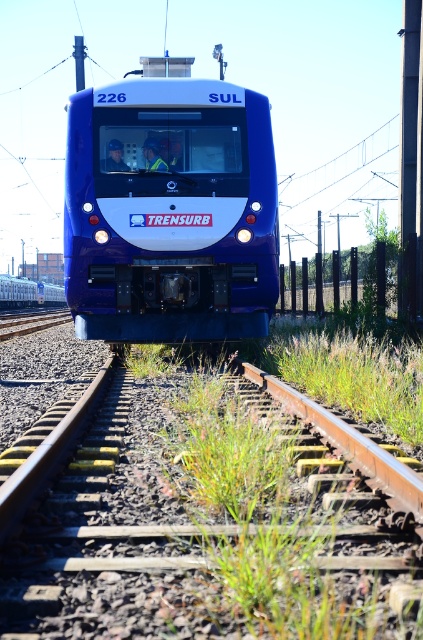
Question: Where is rusty metal train track at center located in relation to matte blue train at center in the image?

Choices:
 (A) left
 (B) right

Answer: (B)

Question: Among these objects, which one is nearest to the camera?

Choices:
 (A) matte blue train at center
 (B) rusty metal train track at center

Answer: (B)

Question: Is rusty metal train track at center positioned behind matte blue train at center?

Choices:
 (A) no
 (B) yes

Answer: (A)

Question: Observing the image, what is the correct spatial positioning of rusty metal train track at center in reference to matte blue train at center?

Choices:
 (A) above
 (B) below

Answer: (B)